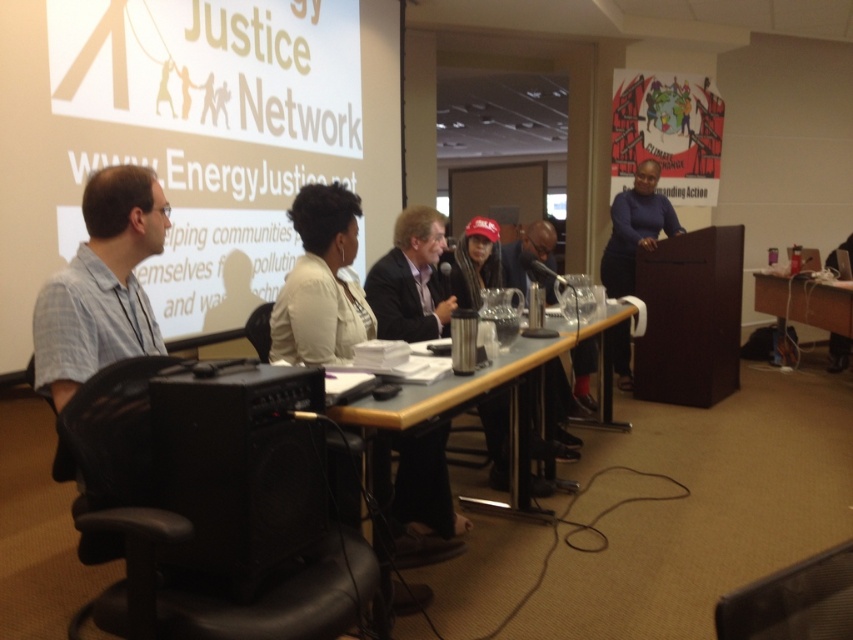
Question: Which point is closer to the camera?

Choices:
 (A) (225, 538)
 (B) (149, 240)
 (C) (410, 529)
 (D) (242, 454)

Answer: (D)

Question: Does white fabric jacket at center appear under matte black suit at center?

Choices:
 (A) no
 (B) yes

Answer: (B)

Question: Is wooden table at center bigger than wooden table at right?

Choices:
 (A) no
 (B) yes

Answer: (B)

Question: Which point is closer to the camera?

Choices:
 (A) dark blue sweater at center
 (B) black leather swivel chair at lower left
 (C) wooden table at right
 (D) white fabric jacket at center

Answer: (B)

Question: Is matte black suit at center to the right of wooden table at center from the viewer's perspective?

Choices:
 (A) yes
 (B) no

Answer: (B)

Question: Among these objects, which one is farthest from the camera?

Choices:
 (A) white fabric jacket at center
 (B) light blue plaid shirt at left

Answer: (A)